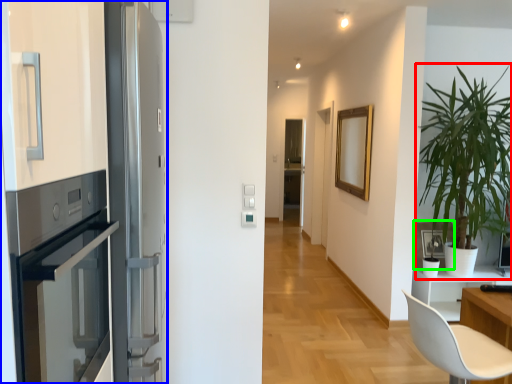
Question: Which object is positioned closest to houseplant (highlighted by a red box)? Select from fridge (highlighted by a blue box) and picture frame (highlighted by a green box).

Choices:
 (A) fridge
 (B) picture frame

Answer: (B)